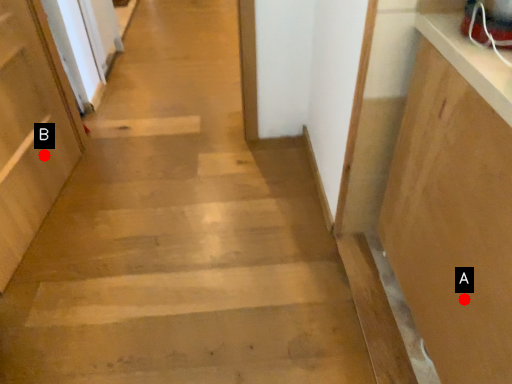
Question: Two points are circled on the image, labeled by A and B beside each circle. Which of the following is the closest to the observer?

Choices:
 (A) A is closer
 (B) B is closer

Answer: (A)